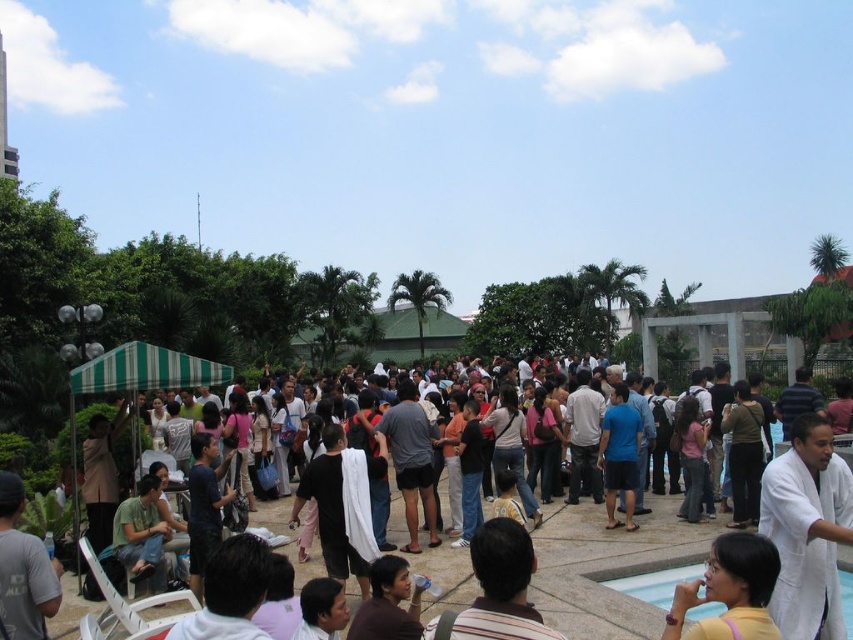
In order to click on white cloth at center in this screenshot , I will do tap(608, 566).

You are a GUI agent. You are given a task and a screenshot of the screen. Output one action in this format:
    pyautogui.click(x=<x>, y=<y>)
    Task: Click on the white cloth at center
    The image size is (853, 640).
    Given the screenshot: What is the action you would take?
    pyautogui.click(x=608, y=566)

Does white cloth at center have a lesser width compared to white stone pool at lower right?

No, white cloth at center is not thinner than white stone pool at lower right.

Describe the element at coordinates (608, 566) in the screenshot. I see `white cloth at center` at that location.

Is point (634, 602) farther from viewer compared to point (618, 573)?

No, (634, 602) is in front of (618, 573).

Image resolution: width=853 pixels, height=640 pixels. In order to click on white cloth at center in this screenshot , I will do `click(608, 566)`.

Can you confirm if matte yellow shirt at lower right is positioned to the left of white stone pool at lower right?

Yes, matte yellow shirt at lower right is to the left of white stone pool at lower right.

How distant is matte yellow shirt at lower right from white stone pool at lower right?

The distance of matte yellow shirt at lower right from white stone pool at lower right is 35.01 feet.

Measure the distance between point (769, 582) and camera.

Point (769, 582) and camera are 66.80 feet apart.

Where is `matte yellow shirt at lower right`? matte yellow shirt at lower right is located at coordinates (730, 589).